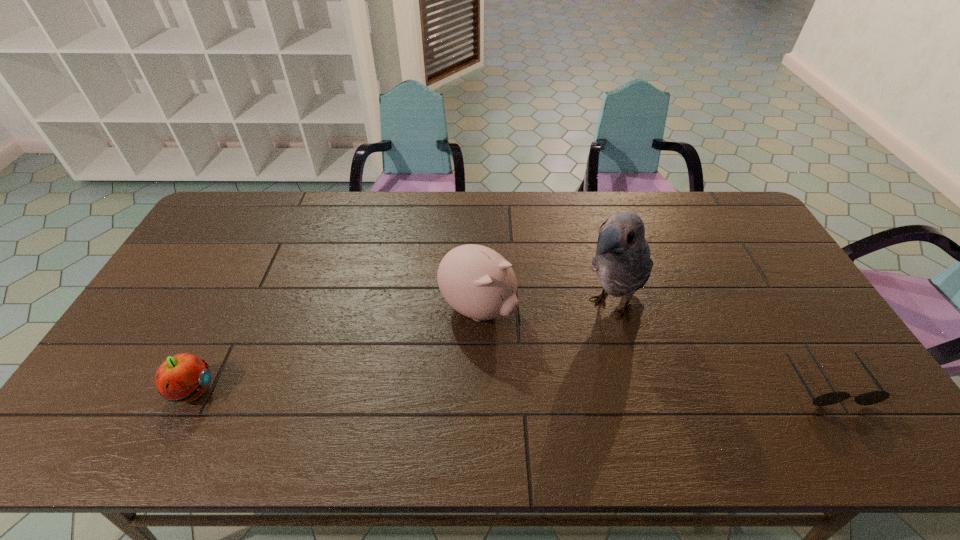
The height and width of the screenshot is (540, 960). I want to click on vacant point located between the piggy bank and the sunglasses, so click(653, 345).

Where is `vacant region between the tallest object and the leftmost object`? Image resolution: width=960 pixels, height=540 pixels. vacant region between the tallest object and the leftmost object is located at coordinates (401, 349).

You are a GUI agent. You are given a task and a screenshot of the screen. Output one action in this format:
    pyautogui.click(x=<x>, y=<y>)
    Task: Click on the free point between the third tallest object and the second object from right to left
    The width and height of the screenshot is (960, 540).
    Given the screenshot: What is the action you would take?
    pyautogui.click(x=401, y=349)

Identify the location of free spot between the rightmost object and the leftmost object. This screenshot has width=960, height=540. (510, 387).

Identify the location of vacant region between the piggy bank and the shortest object. (653, 345).

The image size is (960, 540). In order to click on object that ranks as the second closest to the tallest object in this screenshot , I will do `click(869, 398)`.

The width and height of the screenshot is (960, 540). Identify the location of object that is the second closest to the shortest object. 476,281.

Find the location of a particular element. This screenshot has height=540, width=960. free space that satisfies the following two spatial constraints: 1. on the front side of the tallest object; 2. on the right side of the piggy bank is located at coordinates (477, 307).